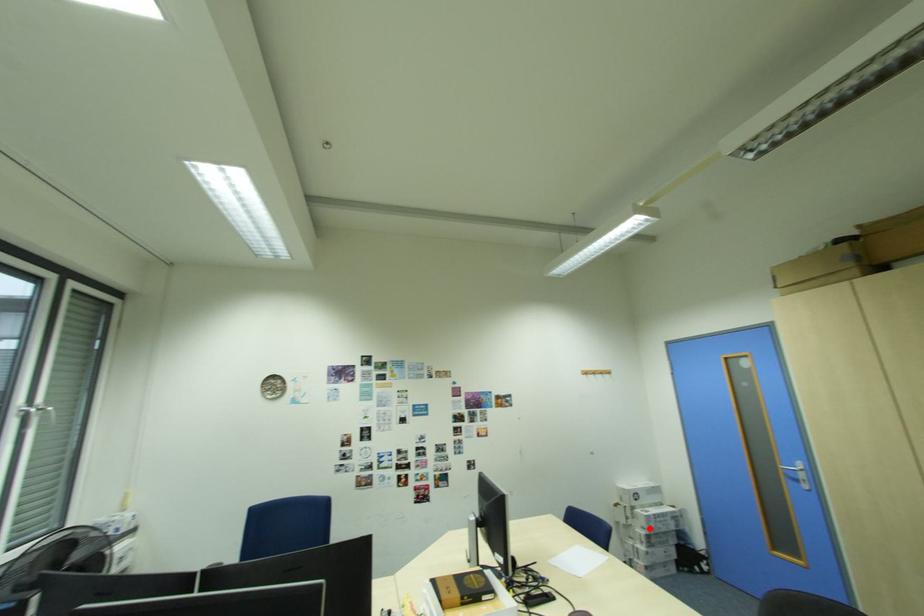
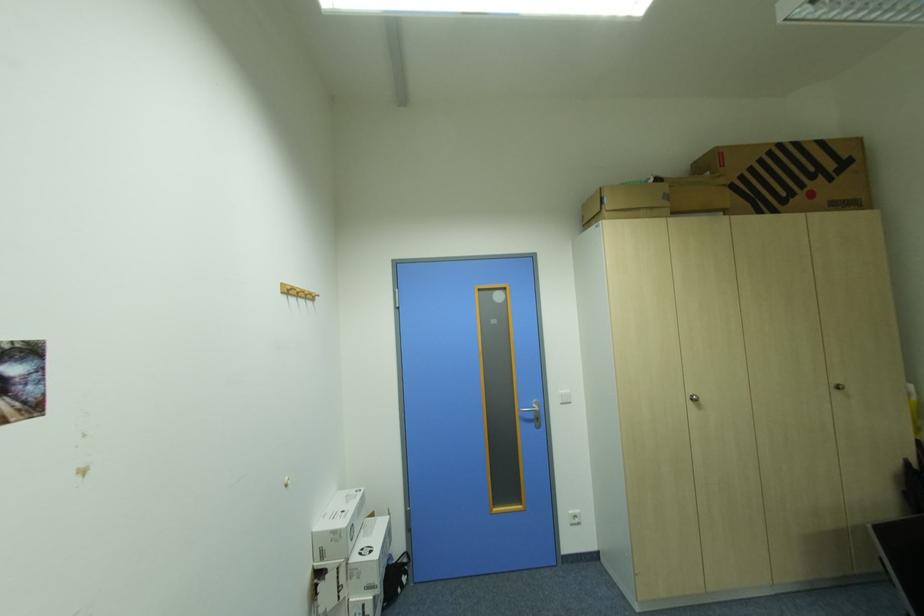
Find the pixel in the second image that matches the highlighted location in the first image.

(377, 590)